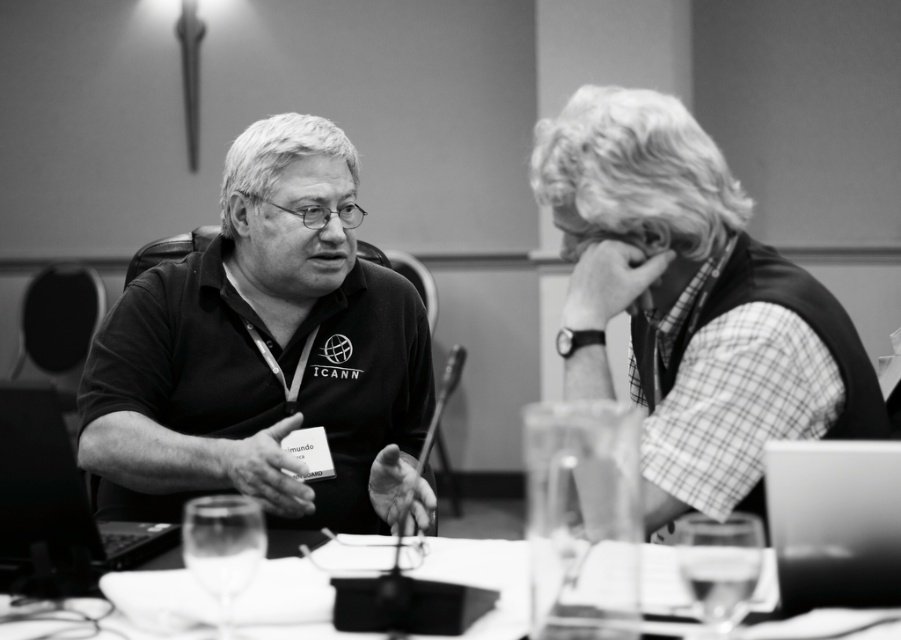
Question: Can you confirm if checkered fabric shirt at right is positioned to the right of metallic silver laptop at lower right?

Choices:
 (A) yes
 (B) no

Answer: (B)

Question: Estimate the real-world distances between objects in this image. Which object is farther from the metallic laptop at left?

Choices:
 (A) metallic silver laptop at lower right
 (B) checkered fabric shirt at right
 (C) transparent glass table at center

Answer: (A)

Question: Is the position of transparent glass table at center less distant than that of metallic laptop at left?

Choices:
 (A) yes
 (B) no

Answer: (A)

Question: Estimate the real-world distances between objects in this image. Which object is closer to the metallic laptop at left?

Choices:
 (A) metallic silver laptop at lower right
 (B) checkered fabric shirt at right
 (C) matte black polo shirt at center
 (D) transparent glass table at center

Answer: (D)

Question: Which point appears farthest from the camera in this image?

Choices:
 (A) (287, 376)
 (B) (6, 557)
 (C) (811, 513)
 (D) (435, 554)

Answer: (A)

Question: Can you confirm if matte black polo shirt at center is thinner than checkered fabric shirt at right?

Choices:
 (A) yes
 (B) no

Answer: (B)